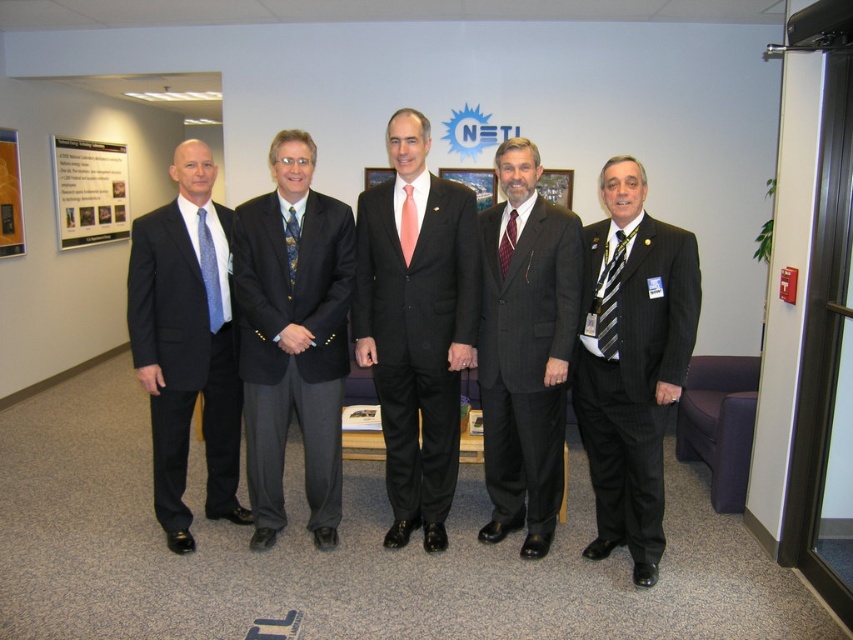
Question: Is matte black suit at center further to camera compared to pink satin tie at center?

Choices:
 (A) no
 (B) yes

Answer: (A)

Question: Among these points, which one is nearest to the camera?

Choices:
 (A) (492, 449)
 (B) (622, 330)

Answer: (B)

Question: Observing the image, what is the correct spatial positioning of pink satin tie at center in reference to blue silk tie at center?

Choices:
 (A) below
 (B) above

Answer: (B)

Question: Which object appears closest to the camera in this image?

Choices:
 (A) pink satin tie at center
 (B) blue silk tie at center
 (C) striped fabric tie at right
 (D) matte black suit at left

Answer: (C)

Question: Which point appears closest to the camera in this image?

Choices:
 (A) (383, 304)
 (B) (198, 243)
 (C) (496, 518)
 (D) (299, 355)

Answer: (D)

Question: Considering the relative positions of matte black suit at center and matte black suit at left in the image provided, where is matte black suit at center located with respect to matte black suit at left?

Choices:
 (A) below
 (B) above

Answer: (B)